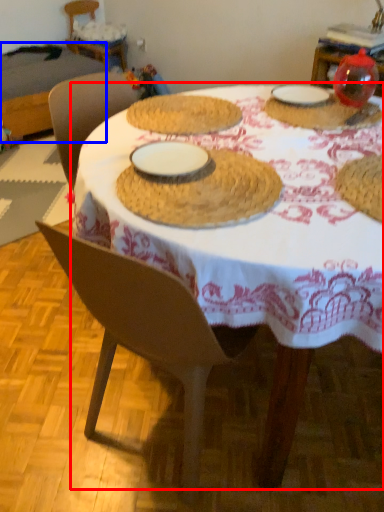
Question: Which point is closer to the camera, table (highlighted by a red box) or table (highlighted by a blue box)?

Choices:
 (A) table
 (B) table

Answer: (A)